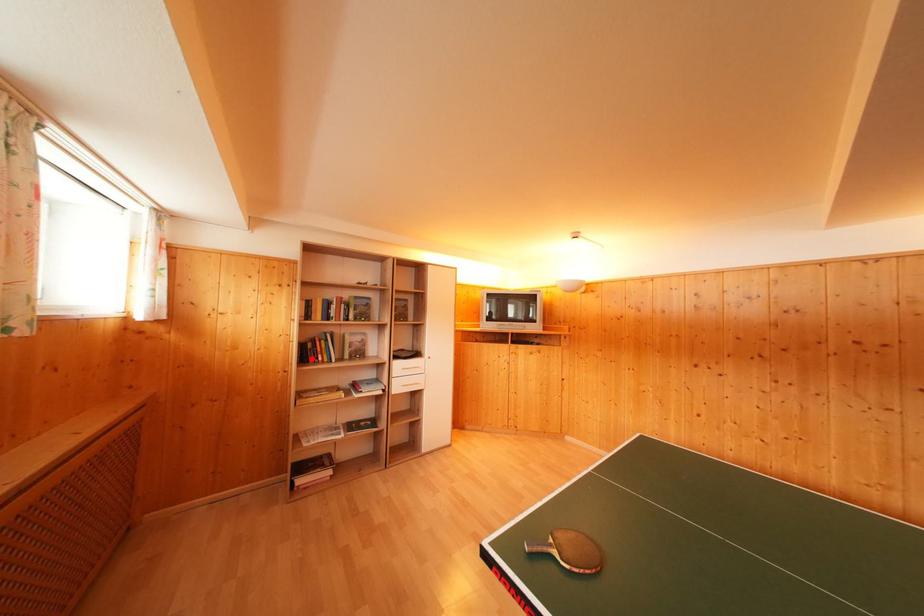
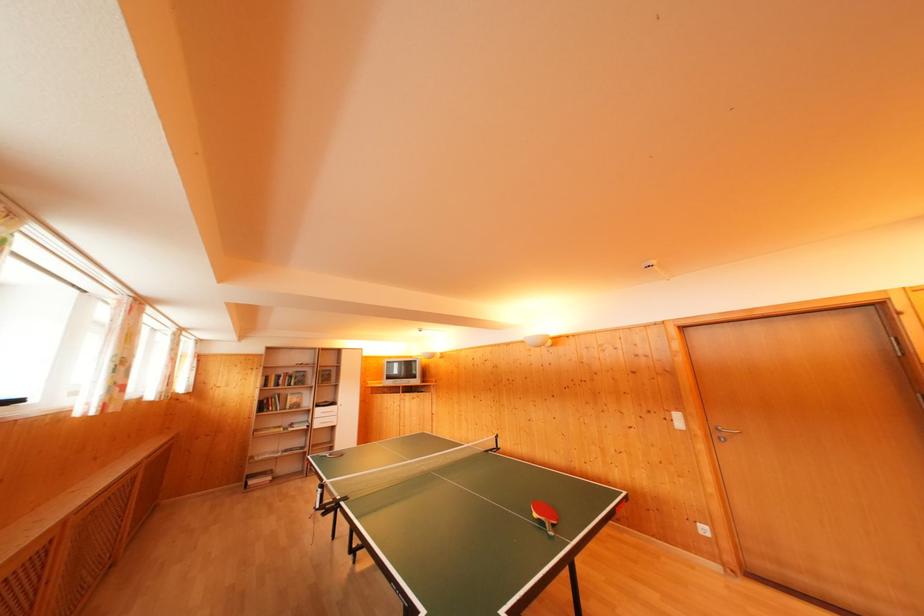
Locate, in the second image, the point that corresponds to the highlighted location in the first image.

(268, 411)